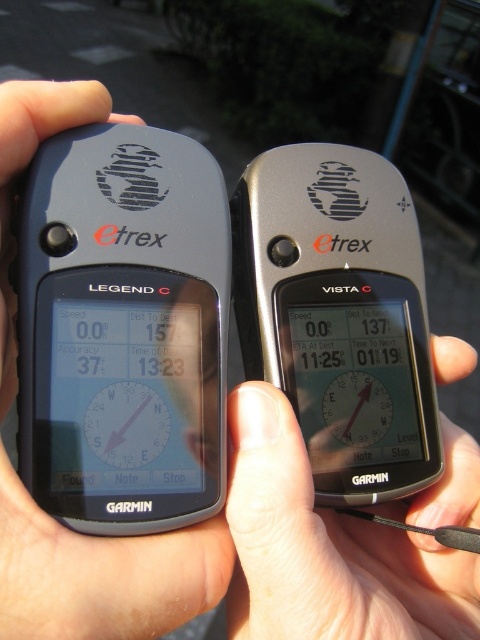
From the picture: You are trying to read the time on the matte black clock at center but there is a skinny silver phone at center blocking your view. Can you see the clock clearly?

The skinny silver phone at center is in front of the matte black clock at center, so it is blocking the view of the clock. You cannot see the matte black clock at center clearly.

What is the 2D location coordinate of the black matte GPS device at center?

The 2D location of the black matte GPS device at center is at point (101,573).